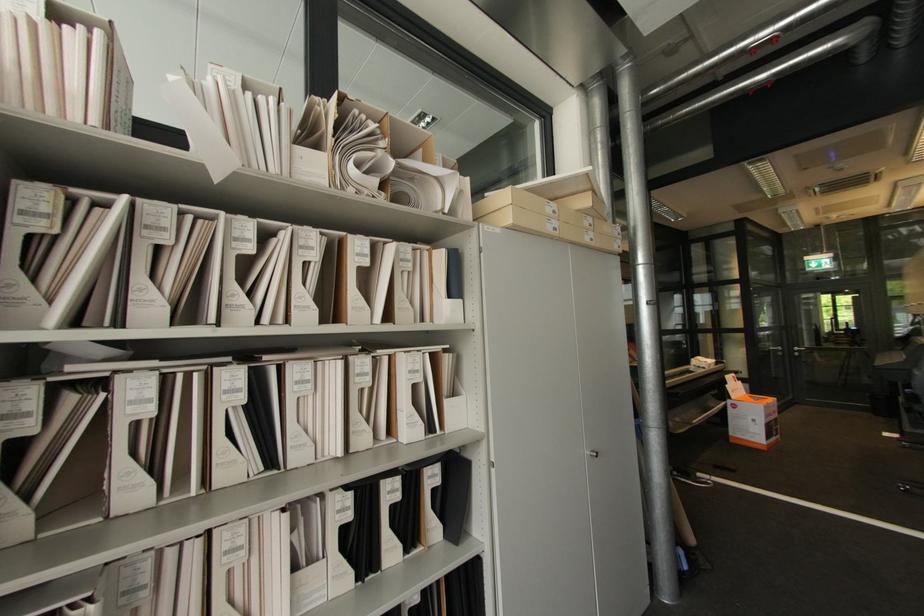
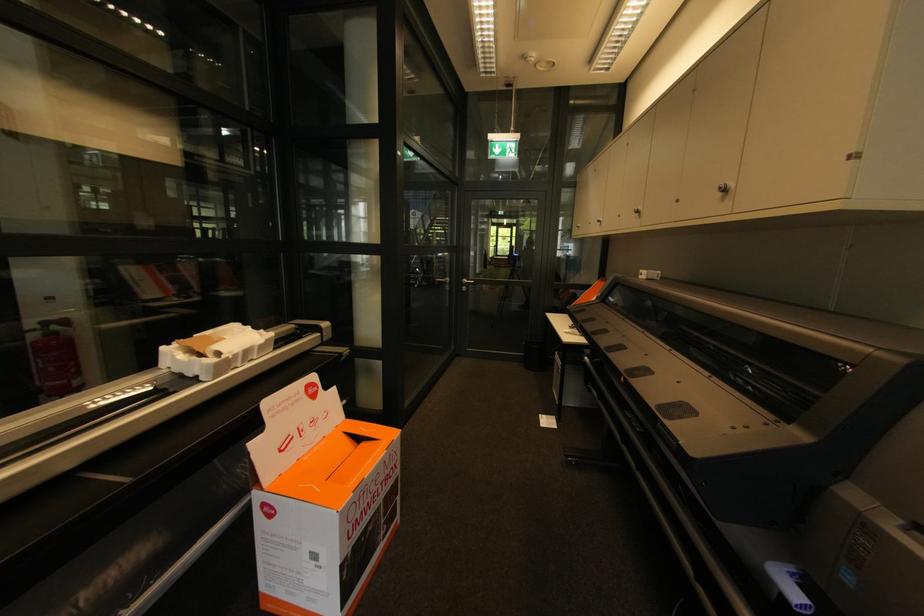
The point at (749, 419) is marked in the first image. Where is the corresponding point in the second image?

(299, 549)